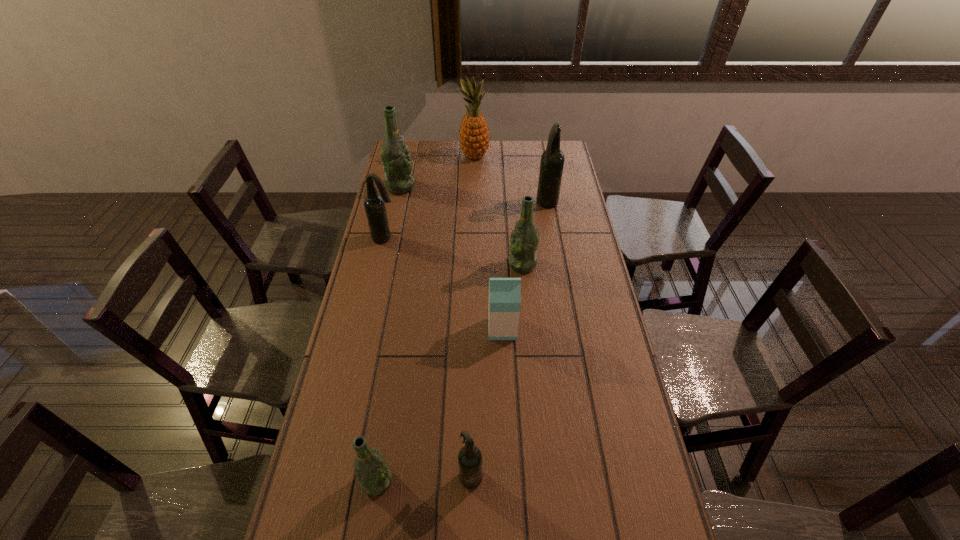
Image resolution: width=960 pixels, height=540 pixels. Find the location of `white milk carton`. white milk carton is located at coordinates (504, 293).

Locate an element on the screen. The image size is (960, 540). the second dark beer bottle from right to left is located at coordinates (470, 457).

Find the location of a particular element. This screenshot has width=960, height=540. the smallest dark beer bottle is located at coordinates (470, 457).

Image resolution: width=960 pixels, height=540 pixels. What are the coordinates of `the smallest green beer bottle` in the screenshot? It's located at (374, 475).

Where is `free space located 0.070m on the front of the pineapple`? Image resolution: width=960 pixels, height=540 pixels. free space located 0.070m on the front of the pineapple is located at coordinates (474, 173).

Where is `vacant space located 0.390m on the surface of the farthest beer bottle`? vacant space located 0.390m on the surface of the farthest beer bottle is located at coordinates (501, 187).

Find the location of a particular element. The height and width of the screenshot is (540, 960). free space located on the front of the rightmost object is located at coordinates (559, 268).

Locate an element on the screen. The height and width of the screenshot is (540, 960). free spot located on the surface of the second farthest green beer bottle is located at coordinates (428, 265).

The height and width of the screenshot is (540, 960). Identify the location of vacant area located 0.380m on the surface of the second farthest green beer bottle. (407, 265).

Locate an element on the screen. Image resolution: width=960 pixels, height=540 pixels. vacant space located on the surface of the second farthest green beer bottle is located at coordinates (425, 265).